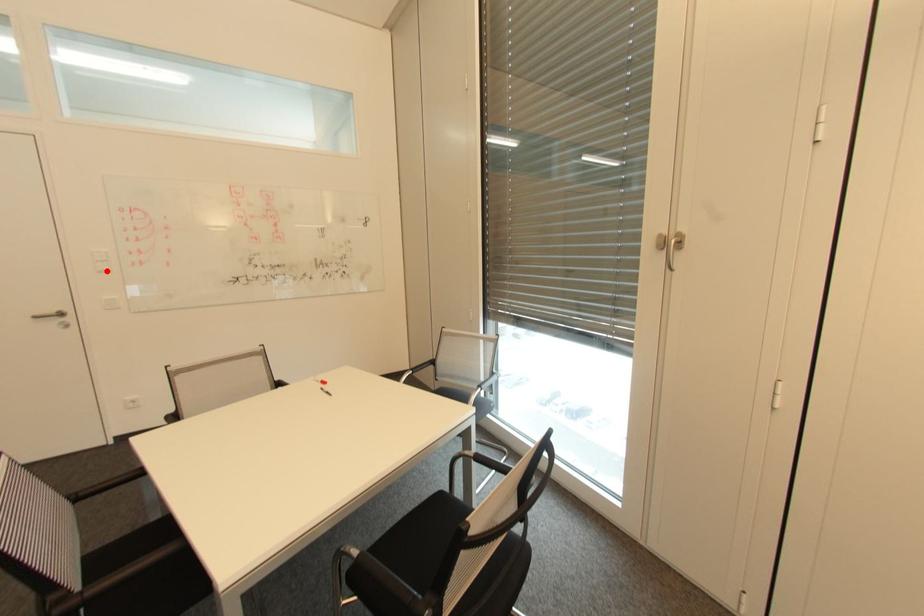
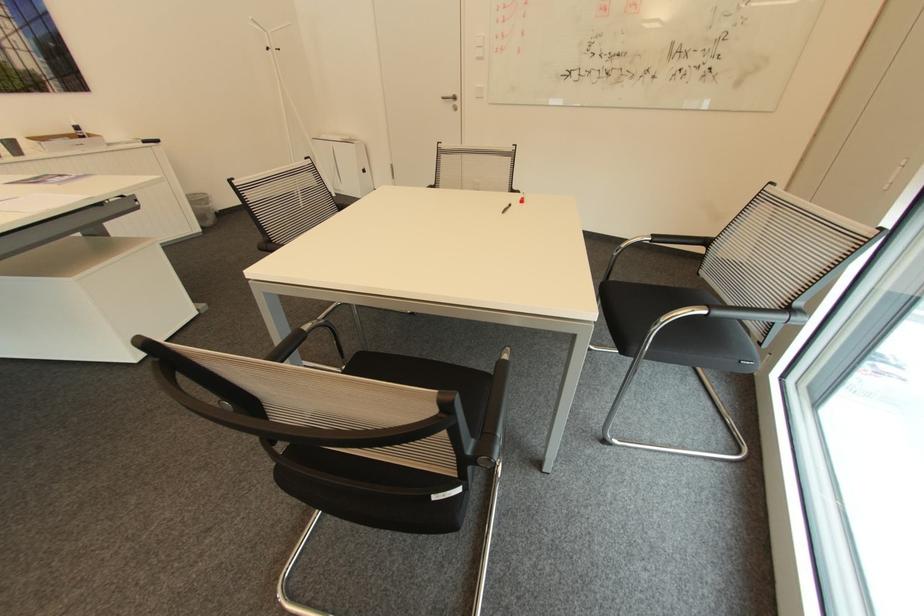
In the second image, find the point that corresponds to the highlighted location in the first image.

(482, 59)